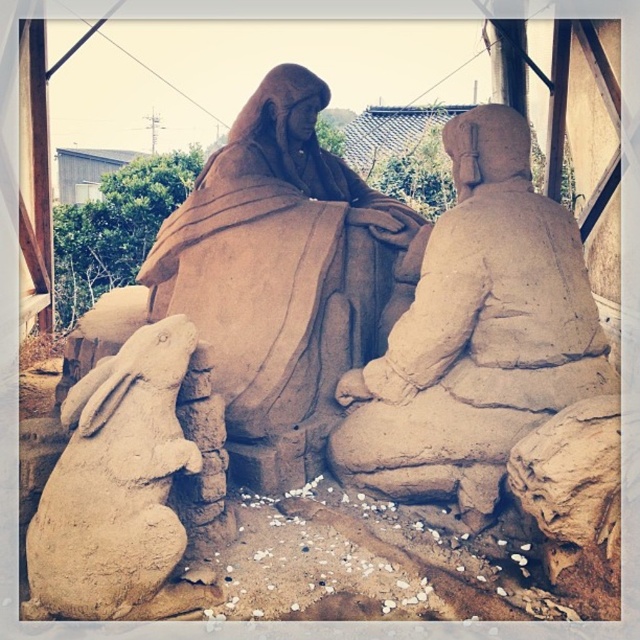
Question: Observing the image, what is the correct spatial positioning of matte clay figure at center in reference to smooth beige rabbit at lower left?

Choices:
 (A) right
 (B) left

Answer: (A)

Question: Does matte clay figure at center have a smaller size compared to smooth beige rabbit at lower left?

Choices:
 (A) yes
 (B) no

Answer: (B)

Question: Is matte clay figure at center in front of smooth beige rabbit at lower left?

Choices:
 (A) yes
 (B) no

Answer: (B)

Question: Which point is farther from the camera taking this photo?

Choices:
 (A) (378, 477)
 (B) (58, 492)

Answer: (A)